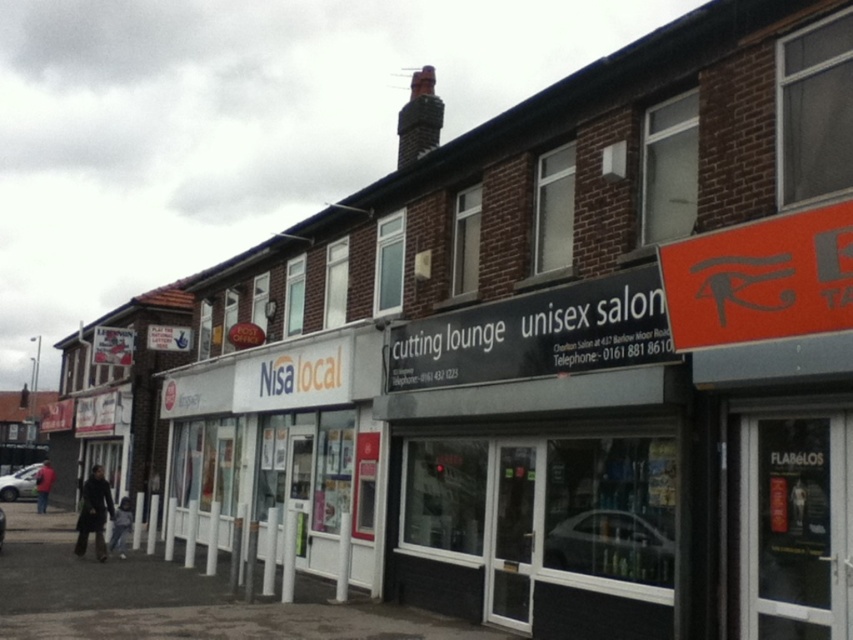
Question: Is black plastic sign at center further to camera compared to orange matte sign at upper right?

Choices:
 (A) yes
 (B) no

Answer: (A)

Question: Which point is farther to the camera?

Choices:
 (A) orange matte sign at upper right
 (B) dark brown leather jacket at lower left
 (C) black plastic sign at center
 (D) red fabric jacket at lower left

Answer: (D)

Question: Does black plastic sign at center have a lesser width compared to dark gray hoodie at lower left?

Choices:
 (A) no
 (B) yes

Answer: (A)

Question: Which object is positioned farthest from the black plastic sign at center?

Choices:
 (A) dark brown leather jacket at lower left
 (B) dark gray hoodie at lower left

Answer: (A)

Question: Which of the following is the closest to the observer?

Choices:
 (A) dark gray hoodie at lower left
 (B) dark brown leather jacket at lower left

Answer: (B)

Question: Does dark brown leather jacket at lower left appear on the left side of red fabric jacket at lower left?

Choices:
 (A) yes
 (B) no

Answer: (B)